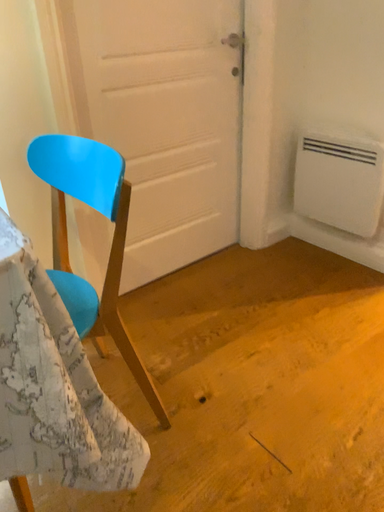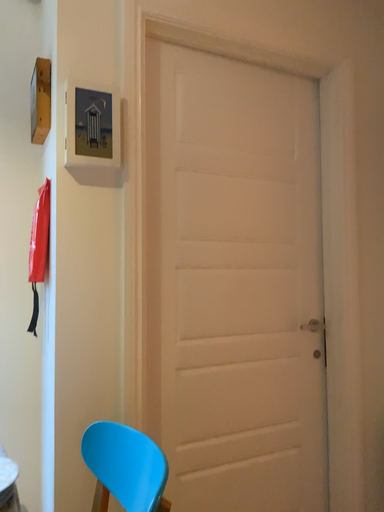
Question: How did the camera likely rotate when shooting the video?

Choices:
 (A) rotated downward
 (B) rotated upward

Answer: (B)